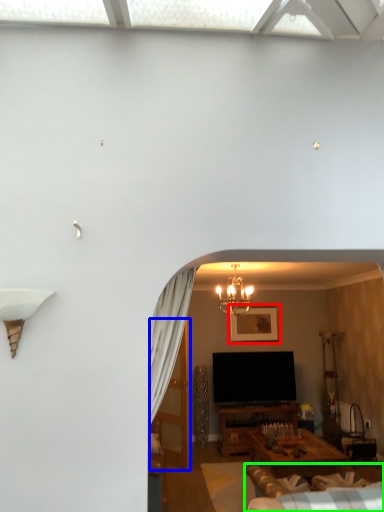
Question: Which is farther away from picture frame (highlighted by a red box)? glass door (highlighted by a blue box) or couch (highlighted by a green box)?

Choices:
 (A) glass door
 (B) couch

Answer: (B)